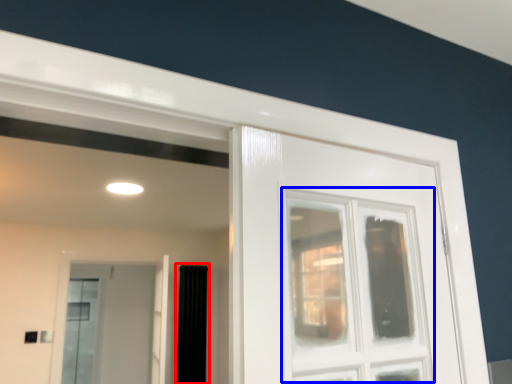
Question: Among these objects, which one is farthest to the camera, curtain (highlighted by a red box) or window (highlighted by a blue box)?

Choices:
 (A) curtain
 (B) window

Answer: (A)